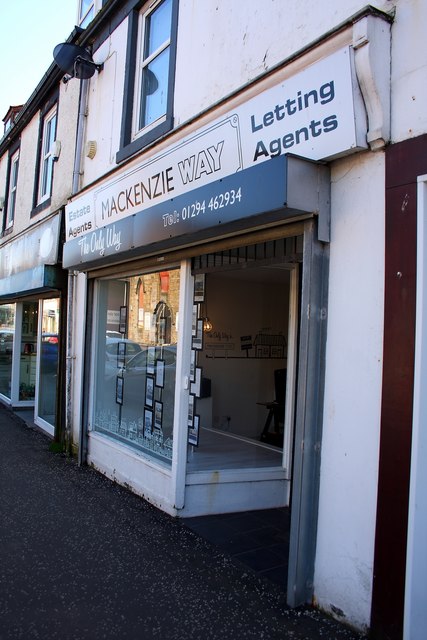
Where is `window`? window is located at coordinates (103, 384).